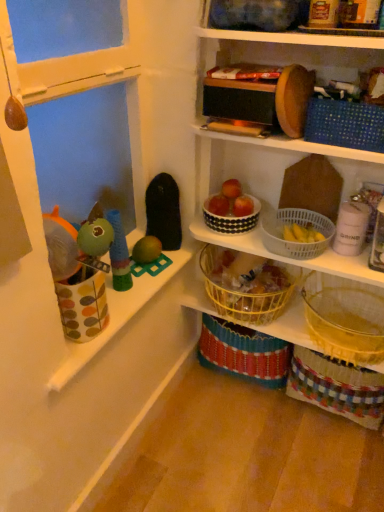
Locate an element on the screen. space that is in front of red matte apple at center, the 3th apple in the right-to-left sequence is located at coordinates (243, 234).